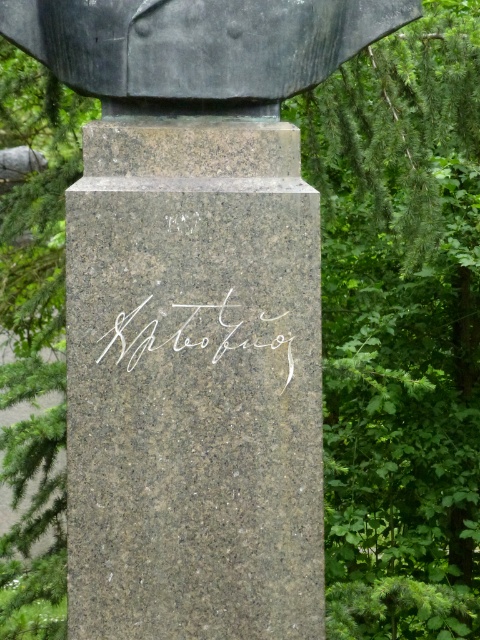
Is polished dark gray bust at upper center bigger than white metallic writing at center?

Yes.

Is the position of polished dark gray bust at upper center more distant than that of white metallic writing at center?

No, polished dark gray bust at upper center is in front of white metallic writing at center.

At what (x,y) coordinates should I click in order to perform the action: click on polished dark gray bust at upper center. Please return your answer as a coordinate pair (x, y). The image size is (480, 640). Looking at the image, I should click on (196, 48).

Locate an element on the screen. polished dark gray bust at upper center is located at coordinates pyautogui.click(x=196, y=48).